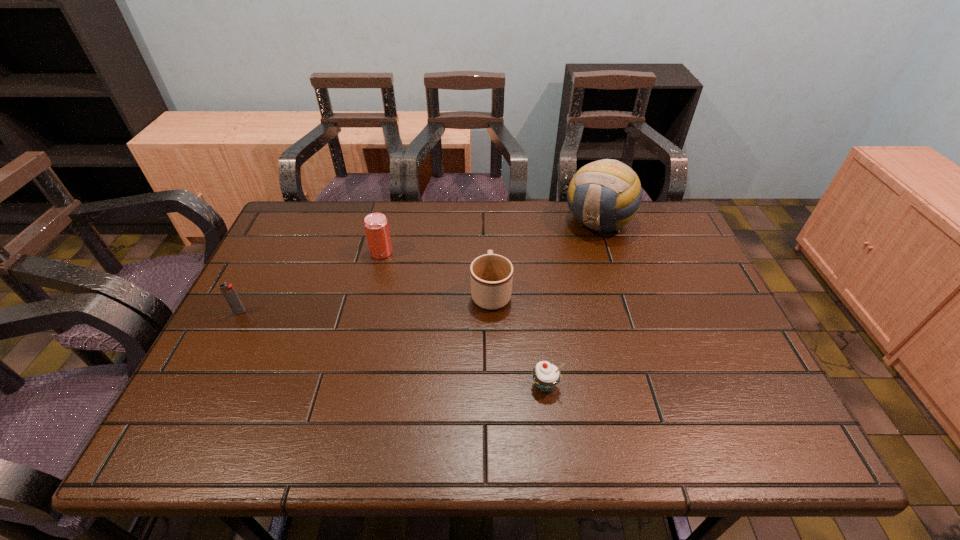
This screenshot has height=540, width=960. What are the coordinates of `free space located 0.370m on the side of the third object from left to right with the handle` in the screenshot? It's located at (489, 200).

Find the location of `vacant space situated on the side of the third object from left to right with the handle`. vacant space situated on the side of the third object from left to right with the handle is located at coordinates (489, 217).

This screenshot has height=540, width=960. In order to click on free region located on the side of the third object from left to right with the handle in this screenshot , I will do `click(490, 219)`.

Identify the location of vacant space located on the back of the igniter. (255, 282).

Identify the location of free space located 0.110m on the back of the second object from right to left. (539, 335).

What are the coordinates of `volleyball that is at the far edge` in the screenshot? It's located at (604, 195).

The width and height of the screenshot is (960, 540). Identify the location of beer can positioned at the far edge. (376, 226).

At what (x,y) coordinates should I click in order to perform the action: click on object located at the left edge. Please return your answer as a coordinate pair (x, y). Looking at the image, I should click on (231, 296).

What are the coordinates of `object that is at the right edge` in the screenshot? It's located at (604, 195).

This screenshot has height=540, width=960. I want to click on object at the far right corner, so click(x=604, y=195).